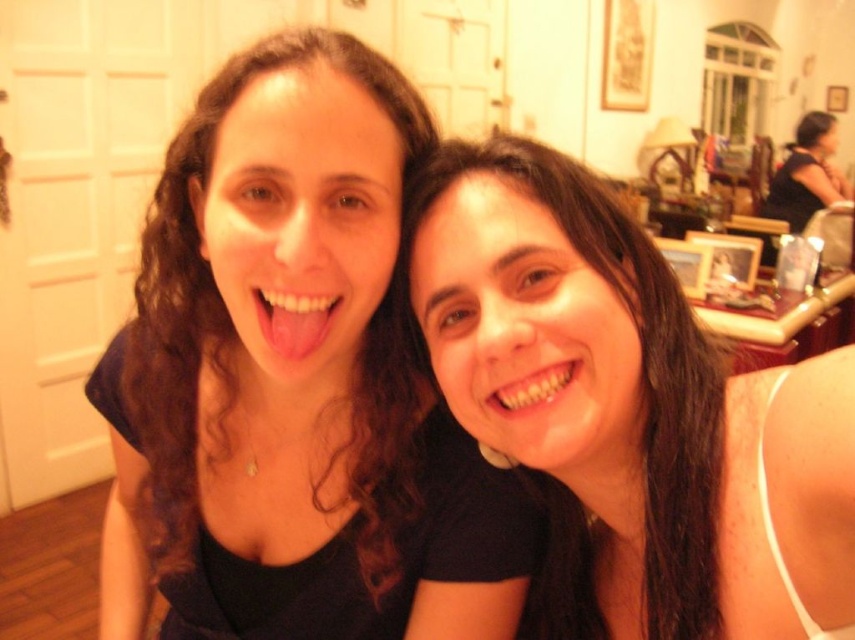
Question: Considering the real-world distances, which object is closest to the white glossy teeth at center?

Choices:
 (A) matte black hair at center
 (B) pink glossy tongue at center
 (C) black fabric shirt at upper right

Answer: (A)

Question: Which object is the farthest from the pink glossy tongue at center?

Choices:
 (A) matte black hair at center
 (B) white glossy teeth at center

Answer: (A)

Question: Does pink glossy tongue at center lie in front of white glossy teeth at center?

Choices:
 (A) yes
 (B) no

Answer: (B)

Question: Estimate the real-world distances between objects in this image. Which object is farther from the pink glossy tongue at center?

Choices:
 (A) matte black hair at center
 (B) matte black shirt at center

Answer: (A)

Question: Is matte black shirt at center smaller than black fabric shirt at upper right?

Choices:
 (A) yes
 (B) no

Answer: (A)

Question: Is matte black shirt at center positioned at the back of black fabric shirt at upper right?

Choices:
 (A) no
 (B) yes

Answer: (A)